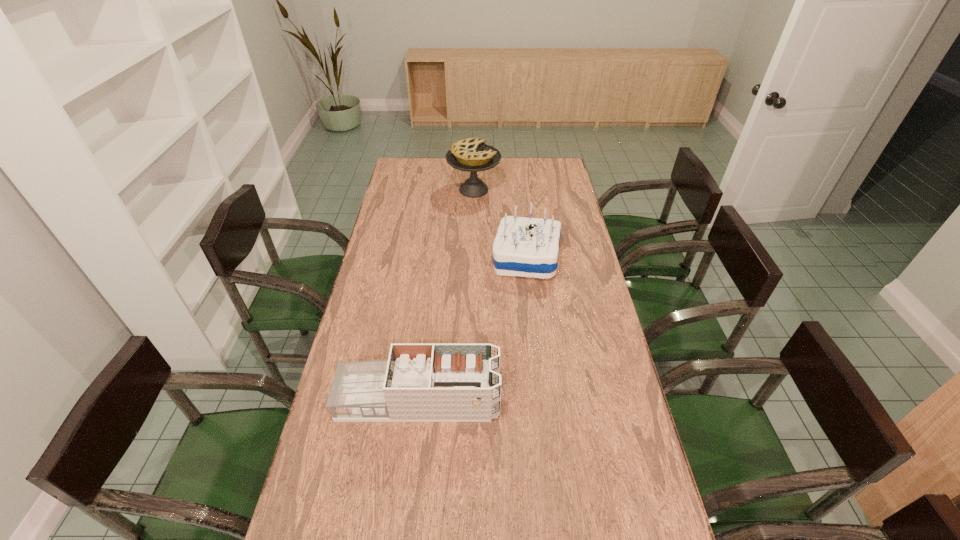
In the image, there is a desktop. Where is `vacant space at the far edge`? vacant space at the far edge is located at coordinates [x=437, y=172].

You are a GUI agent. You are given a task and a screenshot of the screen. Output one action in this format:
    pyautogui.click(x=<x>, y=<y>)
    Task: Click on the free space at the left edge of the desktop
    
    Given the screenshot: What is the action you would take?
    pyautogui.click(x=315, y=493)

You are a GUI agent. You are given a task and a screenshot of the screen. Output one action in this format:
    pyautogui.click(x=<x>, y=<y>)
    Task: Click on the free space at the right edge of the desktop
    Image resolution: width=960 pixels, height=540 pixels.
    Given the screenshot: What is the action you would take?
    pyautogui.click(x=562, y=240)

This screenshot has height=540, width=960. Identify the location of free spot between the shortest object and the second farthest object. (472, 329).

Image resolution: width=960 pixels, height=540 pixels. Find the location of `free space between the pie and the shortest object`. free space between the pie and the shortest object is located at coordinates (446, 295).

Locate an element on the screen. The width and height of the screenshot is (960, 540). free spot between the birthday cake and the shortest object is located at coordinates (472, 329).

This screenshot has height=540, width=960. Identify the location of object that is the second closest one to the nearest object. (472, 155).

You are a GUI agent. You are given a task and a screenshot of the screen. Output one action in this format:
    pyautogui.click(x=<x>, y=<y>)
    Task: Click on the object that is the closest to the shortest object
    This screenshot has height=540, width=960.
    Given the screenshot: What is the action you would take?
    pyautogui.click(x=527, y=247)

Find the location of a particular element. Image resolution: width=960 pixels, height=540 pixels. blank space that satisfies the following two spatial constraints: 1. on the cut side of the birthday cake; 2. on the right side of the farthest object is located at coordinates tap(472, 258).

At what (x,y) coordinates should I click in order to perform the action: click on free spot that satisfies the following two spatial constraints: 1. on the cut side of the birthday cake; 2. on the right side of the pie. Please return your answer as a coordinate pair (x, y). The width and height of the screenshot is (960, 540). Looking at the image, I should click on (472, 258).